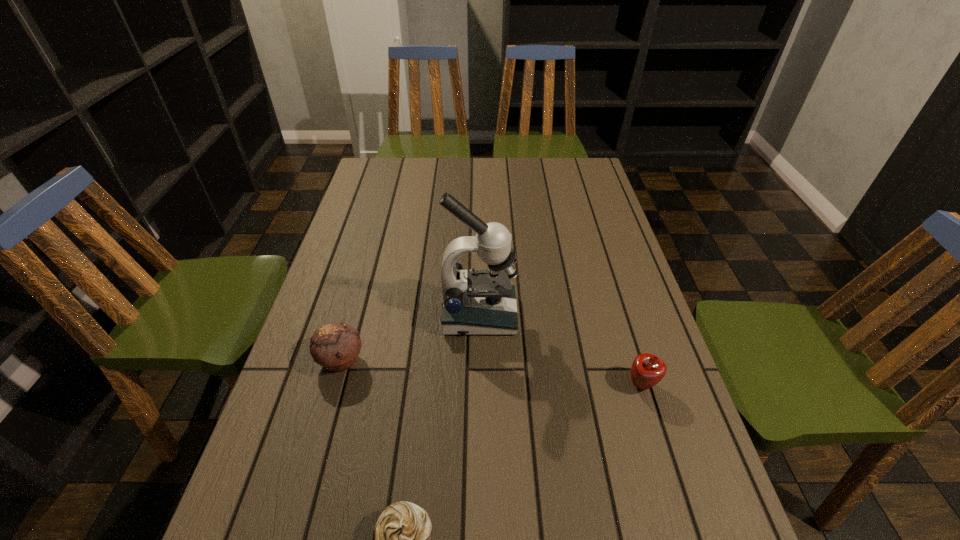
Find the location of a particular element. free space between the apple and the taller muffin is located at coordinates (492, 372).

Image resolution: width=960 pixels, height=540 pixels. Find the location of `the third closest object to the taller muffin`. the third closest object to the taller muffin is located at coordinates (647, 370).

You are a GUI agent. You are given a task and a screenshot of the screen. Output one action in this format:
    pyautogui.click(x=<x>, y=<y>)
    Task: Click on the object that stands as the third closest to the left muffin
    
    Given the screenshot: What is the action you would take?
    pyautogui.click(x=647, y=370)

Locate an element on the screen. vacant space that satisfies the following two spatial constraints: 1. at the eyepiece of the microscope; 2. on the back side of the apple is located at coordinates (479, 384).

Where is `free location that satisfies the following two spatial constraints: 1. at the eyepiece of the rightmost object; 2. on the right side of the tallest object`? free location that satisfies the following two spatial constraints: 1. at the eyepiece of the rightmost object; 2. on the right side of the tallest object is located at coordinates (479, 384).

This screenshot has width=960, height=540. Identify the location of free spot that satisfies the following two spatial constraints: 1. on the front side of the taller muffin; 2. on the left side of the rightmost object. (334, 384).